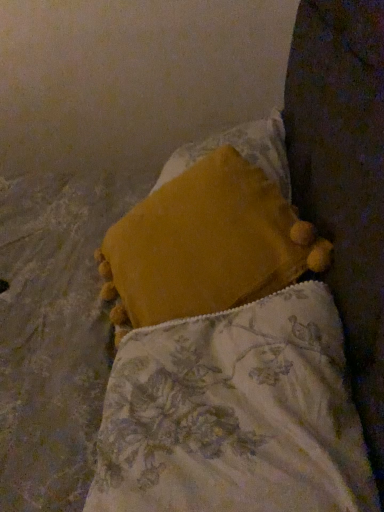
Question: In terms of width, does velvet yellow pillow at center, which is the second pillow in back-to-front order, look wider or thinner when compared to velvety yellow pillow at center, placed as the second pillow when sorted from front to back?

Choices:
 (A) wide
 (B) thin

Answer: (A)

Question: From their relative heights in the image, would you say velvet yellow pillow at center, marked as the 1th pillow in a front-to-back arrangement, is taller or shorter than velvety yellow pillow at center, placed as the second pillow when sorted from front to back?

Choices:
 (A) tall
 (B) short

Answer: (A)

Question: From a real-world perspective, is velvet yellow pillow at center, marked as the 1th pillow in a front-to-back arrangement, above or below velvety yellow pillow at center, which is counted as the 1th pillow, starting from the back?

Choices:
 (A) above
 (B) below

Answer: (B)

Question: Is velvety yellow pillow at center, which is counted as the 1th pillow, starting from the back, in front of or behind velvet yellow pillow at center, which is the second pillow in back-to-front order, in the image?

Choices:
 (A) front
 (B) behind

Answer: (B)

Question: From the image's perspective, is velvety yellow pillow at center, placed as the second pillow when sorted from front to back, positioned above or below velvet yellow pillow at center, marked as the 1th pillow in a front-to-back arrangement?

Choices:
 (A) below
 (B) above

Answer: (B)

Question: Is velvety yellow pillow at center, which is counted as the 1th pillow, starting from the back, to the left or to the right of velvet yellow pillow at center, marked as the 1th pillow in a front-to-back arrangement, in the image?

Choices:
 (A) right
 (B) left

Answer: (A)

Question: Considering the positions of velvety yellow pillow at center, placed as the second pillow when sorted from front to back, and velvet yellow pillow at center, marked as the 1th pillow in a front-to-back arrangement, in the image, is velvety yellow pillow at center, placed as the second pillow when sorted from front to back, taller or shorter than velvet yellow pillow at center, marked as the 1th pillow in a front-to-back arrangement,?

Choices:
 (A) tall
 (B) short

Answer: (B)